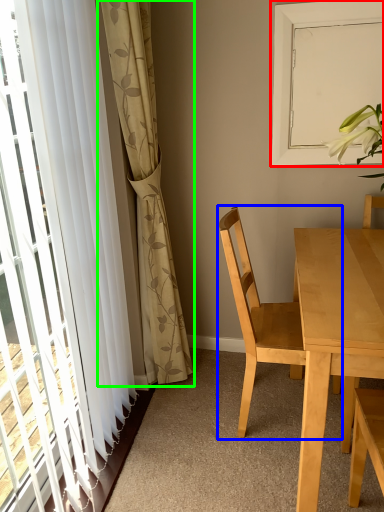
Question: Estimate the real-world distances between objects in this image. Which object is farther from window screen (highlighted by a red box), chair (highlighted by a blue box) or curtain (highlighted by a green box)?

Choices:
 (A) chair
 (B) curtain

Answer: (B)